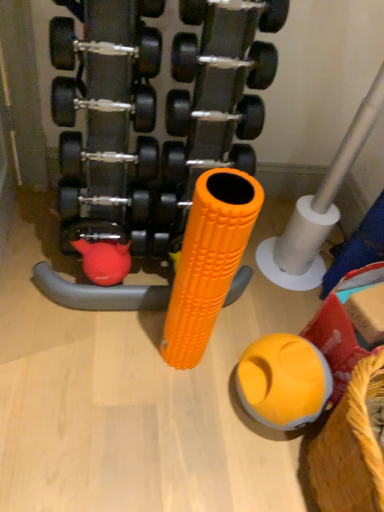
Identify the location of vacant space in silver metallic pipe at center right (from a real-world perspective). (293, 276).